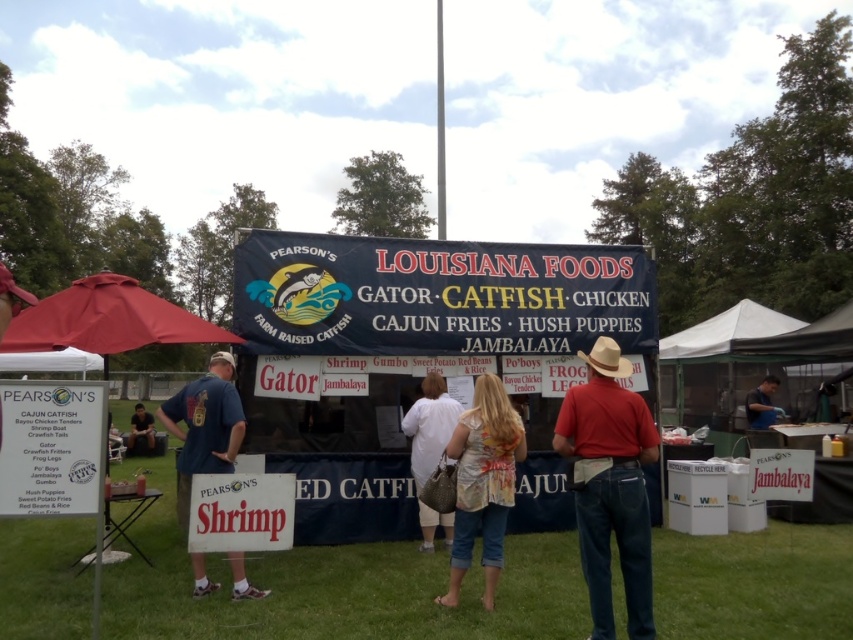
Question: Is red cotton shirt at center further to the viewer compared to red fabric canopy at left?

Choices:
 (A) yes
 (B) no

Answer: (A)

Question: Estimate the real-world distances between objects in this image. Which object is closer to the matte blue shirt at center?

Choices:
 (A) white fabric shirt at center
 (B) red fabric canopy at left
 (C) green grass at lower center
 (D) blue fabric shirt at center

Answer: (D)

Question: Does red cotton shirt at center appear on the right side of red fabric canopy at left?

Choices:
 (A) yes
 (B) no

Answer: (A)

Question: Which point is closer to the camera taking this photo?

Choices:
 (A) (776, 385)
 (B) (440, 404)
 (C) (180, 472)

Answer: (C)

Question: Where is red cotton shirt at center located in relation to denim shorts at center in the image?

Choices:
 (A) above
 (B) below

Answer: (A)

Question: Which of the following is the farthest from the observer?

Choices:
 (A) green grass at lower center
 (B) matte blue shirt at center
 (C) red cotton shirt at center
 (D) red fabric canopy at left

Answer: (B)